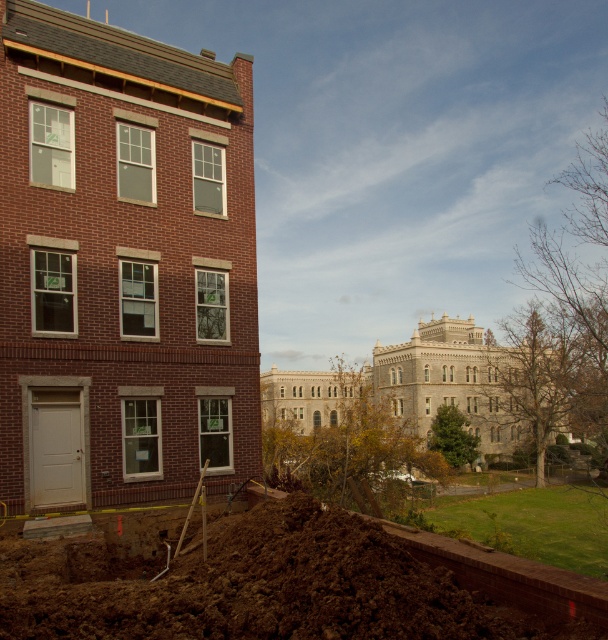
Does brick building at left have a lesser height compared to brown soil at lower left?

No, brick building at left is not shorter than brown soil at lower left.

Can you confirm if brick building at left is thinner than brown soil at lower left?

Incorrect, brick building at left's width is not less than brown soil at lower left's.

Is point (139, 353) behind point (274, 547)?

Yes, point (139, 353) is behind point (274, 547).

Identify the location of brick building at left. This screenshot has width=608, height=640. (122, 262).